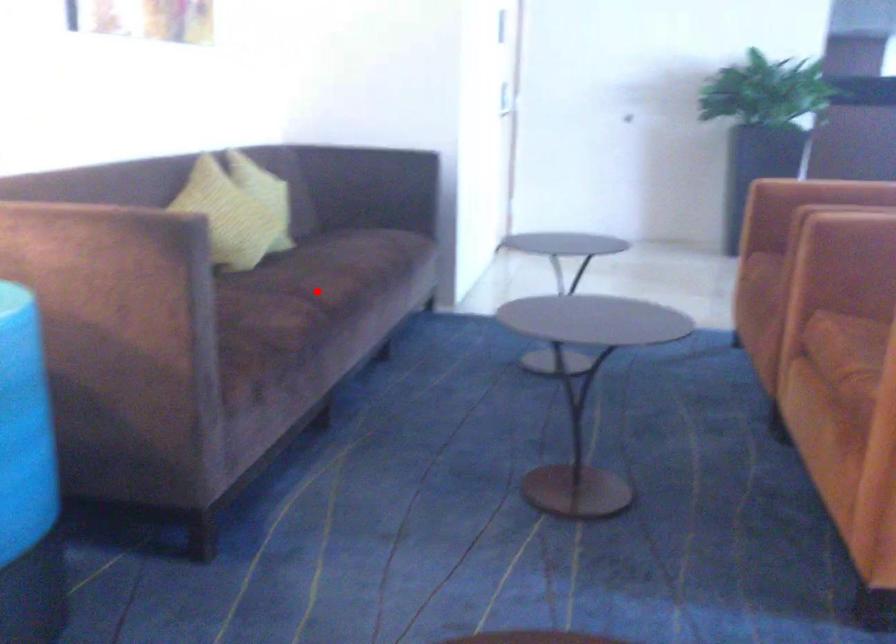
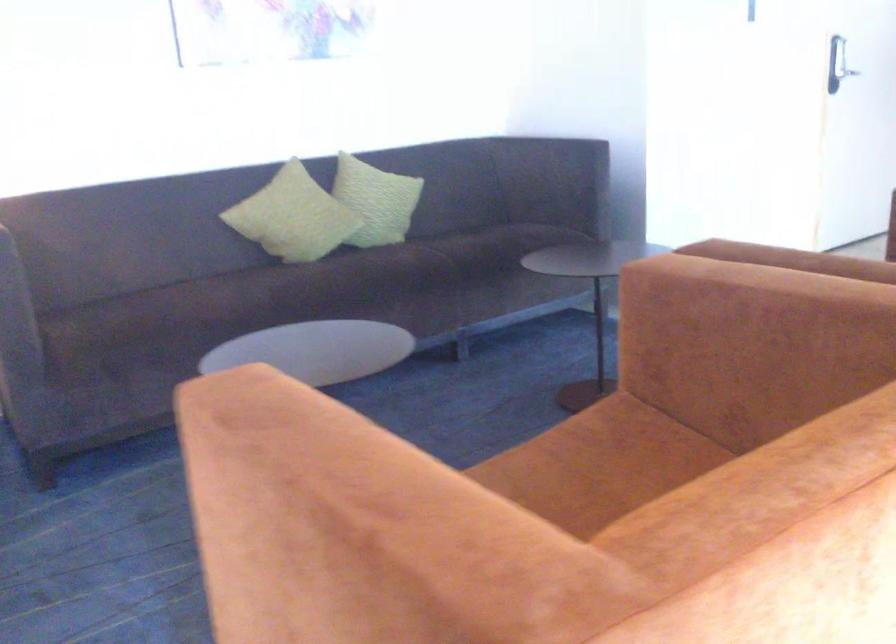
In the second image, find the point that corresponds to the highlighted location in the first image.

(270, 290)